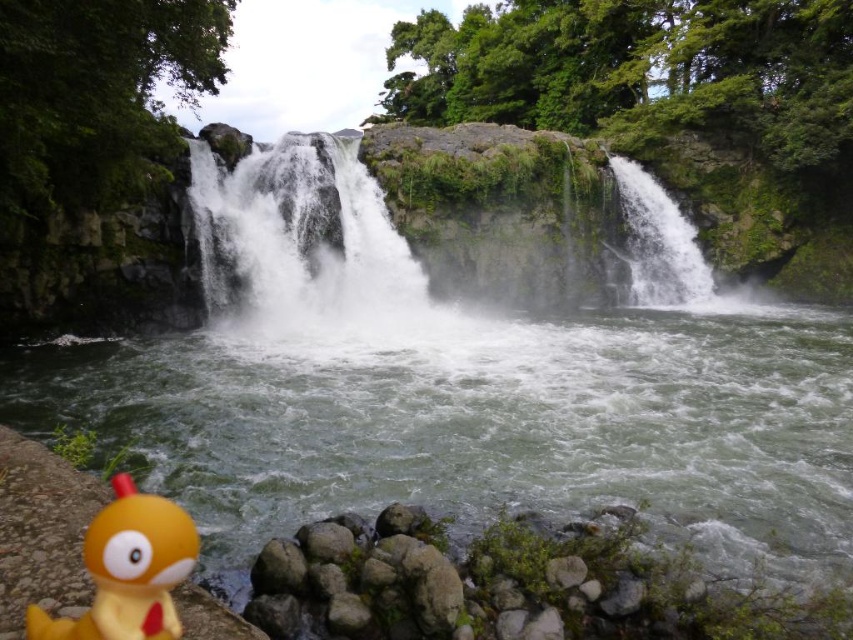
From the picture: Is yellow rubber duck at lower left wider than white frothy water at upper right?

Indeed, yellow rubber duck at lower left has a greater width compared to white frothy water at upper right.

Image resolution: width=853 pixels, height=640 pixels. I want to click on yellow rubber duck at lower left, so tap(128, 570).

Locate an element on the screen. The width and height of the screenshot is (853, 640). yellow rubber duck at lower left is located at coordinates (128, 570).

Is point (289, 321) positioned behind point (117, 557)?

Yes.

Is point (300, 230) closer to viewer compared to point (146, 609)?

No, (300, 230) is further to viewer.

Where is `white frothy water at center`? This screenshot has width=853, height=640. white frothy water at center is located at coordinates (305, 244).

Who is higher up, white frothy water at center or white frothy water at upper right?

white frothy water at center is higher up.

Does point (339, 266) lie in front of point (697, 291)?

Yes, point (339, 266) is closer to viewer.

You are a GUI agent. You are given a task and a screenshot of the screen. Output one action in this format:
    pyautogui.click(x=<x>, y=<y>)
    Task: Click on the white frothy water at center
    
    Given the screenshot: What is the action you would take?
    [x=305, y=244]

Locate an element on the screen. white frothy water at center is located at coordinates (305, 244).